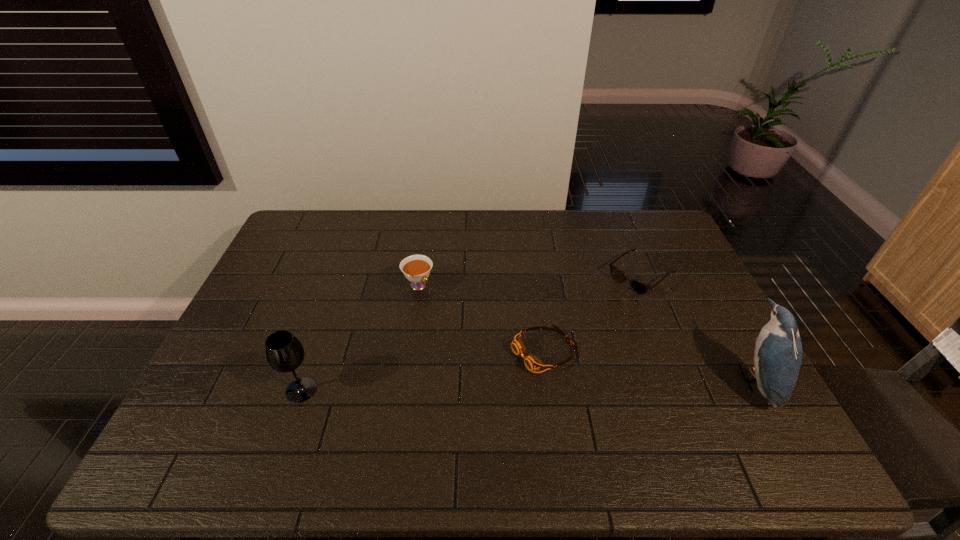
Locate an element on the screen. Image resolution: width=960 pixels, height=540 pixels. unoccupied position between the third shortest object and the goggles is located at coordinates (480, 318).

Locate which object ranks third in proximity to the third shortest object. Please provide its 2D coordinates. Your answer should be formatted as a tuple, i.e. [(x, y)], where the tuple contains the x and y coordinates of a point satisfying the conditions above.

[(640, 288)]

Locate an element on the screen. Image resolution: width=960 pixels, height=540 pixels. object identified as the closest to the goggles is located at coordinates (640, 288).

You are a GUI agent. You are given a task and a screenshot of the screen. Output one action in this format:
    pyautogui.click(x=<x>, y=<y>)
    Task: Click on the vacant area that satisfies the following two spatial constraints: 1. on the back side of the second object from left to right; 2. on the right side of the second tallest object
    The height and width of the screenshot is (540, 960).
    Given the screenshot: What is the action you would take?
    pyautogui.click(x=338, y=285)

Identify the location of free spot that satisfies the following two spatial constraints: 1. on the back side of the rightmost object; 2. at the tip of the fourth shortest object's beak. The height and width of the screenshot is (540, 960). (305, 380).

Find the location of `vacant position in the image that satisfies the following two spatial constraints: 1. on the back side of the goggles; 2. on the right side of the second tallest object`. vacant position in the image that satisfies the following two spatial constraints: 1. on the back side of the goggles; 2. on the right side of the second tallest object is located at coordinates (316, 350).

In order to click on blank area in the image that satisfies the following two spatial constraints: 1. on the back side of the fourth shortest object; 2. on the left side of the fourth object from left to right in this screenshot , I will do `click(341, 276)`.

Where is `free location that satisfies the following two spatial constraints: 1. on the back side of the tallest object; 2. at the tip of the leftmost object's beak`? This screenshot has width=960, height=540. free location that satisfies the following two spatial constraints: 1. on the back side of the tallest object; 2. at the tip of the leftmost object's beak is located at coordinates (305, 380).